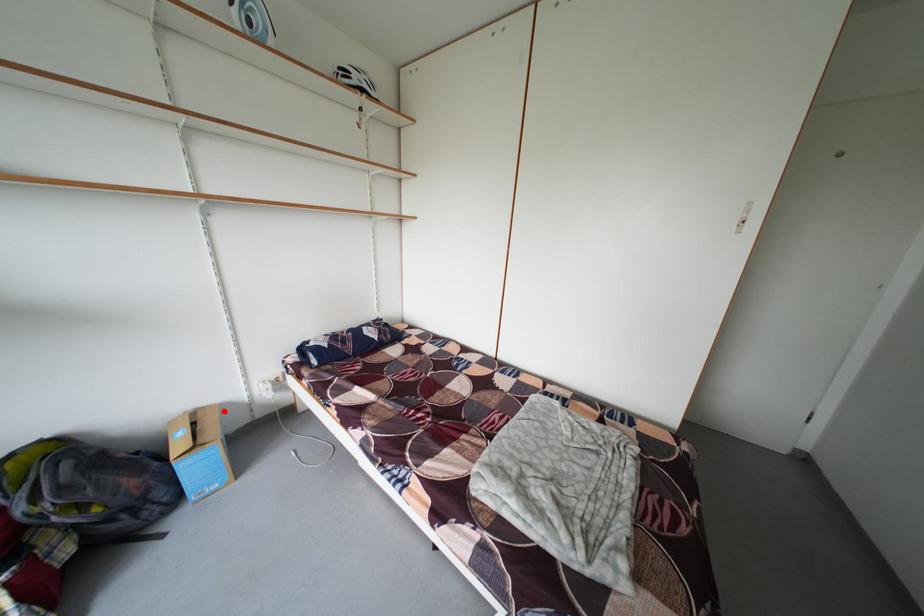
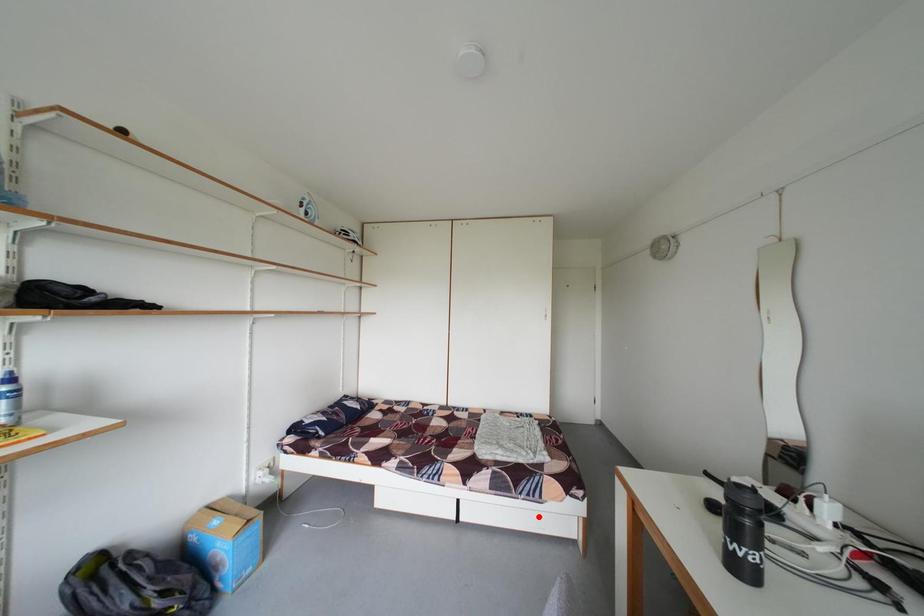
I am providing you with two images of the same scene from different viewpoints. A red point is marked on the first image and another point is marked on the second image. Do the highlighted points in image1 and image2 indicate the same real-world spot?

No